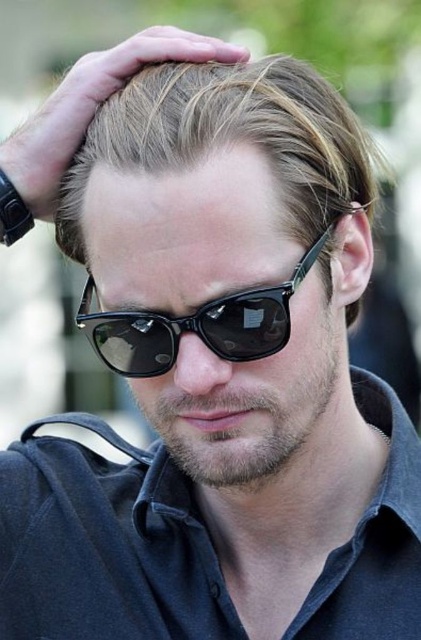
Consider the image. Is light brown smooth hair at center wider than black plastic sunglasses at center?

Yes, light brown smooth hair at center is wider than black plastic sunglasses at center.

Can you confirm if light brown smooth hair at center is smaller than black plastic sunglasses at center?

Actually, light brown smooth hair at center might be larger than black plastic sunglasses at center.

Locate an element on the screen. Image resolution: width=421 pixels, height=640 pixels. light brown smooth hair at center is located at coordinates (229, 136).

Which is in front, point (340, 592) or point (146, 316)?

Point (146, 316)

Which is above, dark blue cotton polo shirt at center or black plastic sunglasses at center?

Positioned higher is black plastic sunglasses at center.

Who is more distant from viewer, (98,460) or (199,314)?

Point (98,460)

Locate an element on the screen. This screenshot has height=640, width=421. dark blue cotton polo shirt at center is located at coordinates (104, 545).

Consider the image. Can you confirm if dark blue cotton polo shirt at center is smaller than light brown smooth hair at center?

No, dark blue cotton polo shirt at center is not smaller than light brown smooth hair at center.

Between point (135, 497) and point (133, 109), which one is positioned in front?

Point (133, 109) is more forward.

Based on the photo, measure the distance between dark blue cotton polo shirt at center and camera.

dark blue cotton polo shirt at center is 92.89 centimeters from camera.

You are a GUI agent. You are given a task and a screenshot of the screen. Output one action in this format:
    pyautogui.click(x=<x>, y=<y>)
    Task: Click on the dark blue cotton polo shirt at center
    This screenshot has height=640, width=421.
    Given the screenshot: What is the action you would take?
    pyautogui.click(x=104, y=545)